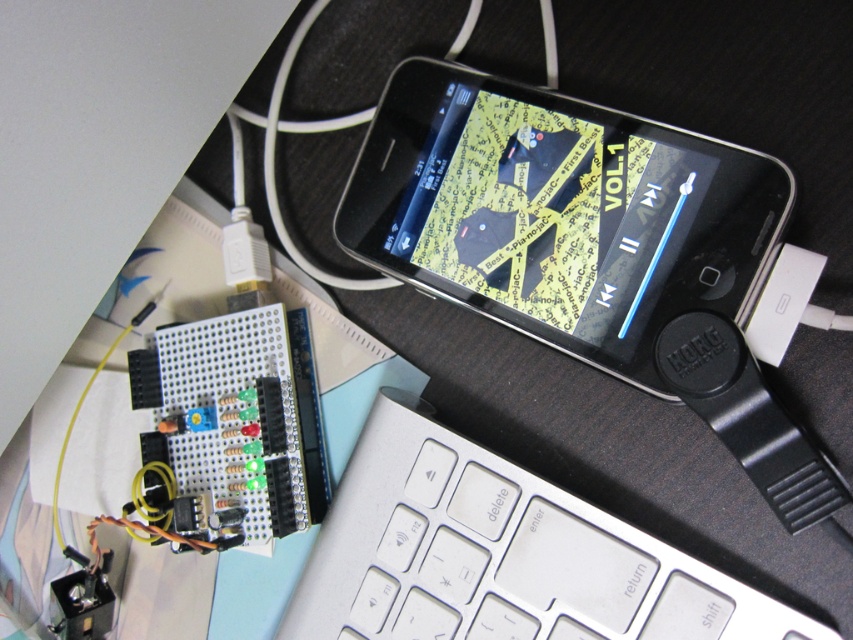
Question: Considering the relative positions of satin black ipod at upper center and silver metallic keyboard at center in the image provided, where is satin black ipod at upper center located with respect to silver metallic keyboard at center?

Choices:
 (A) above
 (B) below

Answer: (A)

Question: Among these objects, which one is farthest from the camera?

Choices:
 (A) satin black ipod at upper center
 (B) silver metallic keyboard at center

Answer: (A)

Question: Can you confirm if satin black ipod at upper center is wider than silver metallic keyboard at center?

Choices:
 (A) no
 (B) yes

Answer: (A)

Question: Which object appears farthest from the camera in this image?

Choices:
 (A) satin black ipod at upper center
 (B) silver metallic keyboard at center

Answer: (A)

Question: Which of the following is the farthest from the observer?

Choices:
 (A) (524, 636)
 (B) (577, 118)

Answer: (B)

Question: Does satin black ipod at upper center have a lesser width compared to silver metallic keyboard at center?

Choices:
 (A) no
 (B) yes

Answer: (B)